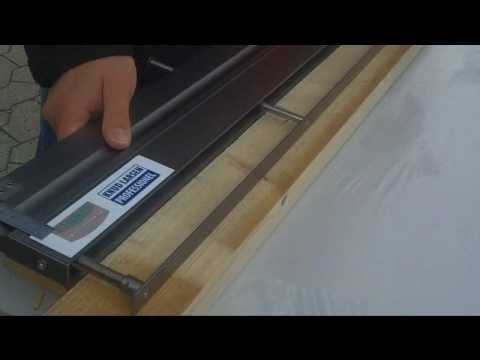
What are the coordinates of `white table` in the screenshot? It's located at (469, 84).